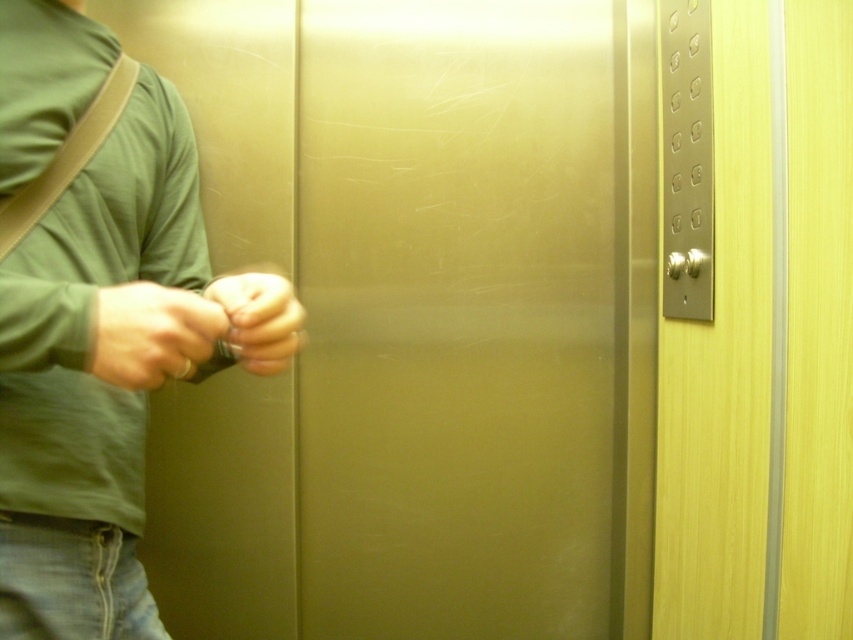
Consider the image. You are standing in the elevator and need to press the button for the 10th floor. The elevator has a satin gold elevator door at center and a matte green shirt at left. Which object is closer to your hand when reaching for the control panel?

The satin gold elevator door at center is 25.00 centimeters away from matte green shirt at left, so the matte green shirt at left is closer to your hand when reaching for the control panel.

You are standing in the elevator and want to press the button for the 5th floor. The control panel is on your right side. Where should you look to find the satin gold elevator door at center?

The satin gold elevator door at center is located at point 0.500 in the x coordinate and 0.536 in the y coordinate.